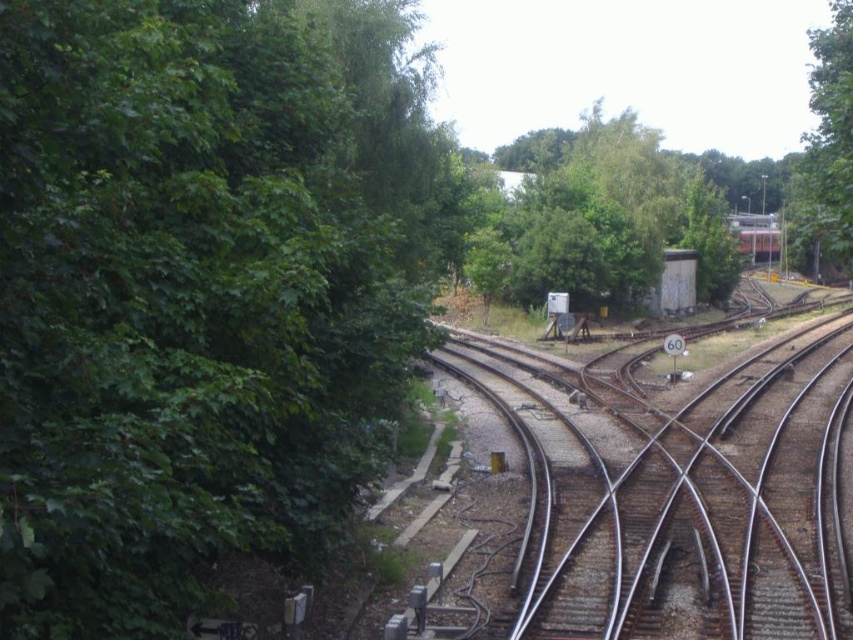
Question: Is green leafy tree at left thinner than green leafy tree at center?

Choices:
 (A) no
 (B) yes

Answer: (B)

Question: Which of the following is the farthest from the observer?

Choices:
 (A) metallic tracks at center
 (B) green leafy tree at left
 (C) green leafy tree at upper right
 (D) metallic red train at center

Answer: (D)

Question: Which point is farther from the camera taking this photo?

Choices:
 (A) (292, 516)
 (B) (550, 605)
 (C) (776, 241)

Answer: (C)

Question: Is green leafy tree at center thinner than green leafy tree at upper right?

Choices:
 (A) yes
 (B) no

Answer: (A)

Question: Among these points, which one is nearest to the camera?

Choices:
 (A) (743, 243)
 (B) (608, 221)
 (C) (810, 401)
 (D) (41, 388)

Answer: (D)

Question: Is green leafy tree at left above green leafy tree at center?

Choices:
 (A) yes
 (B) no

Answer: (B)